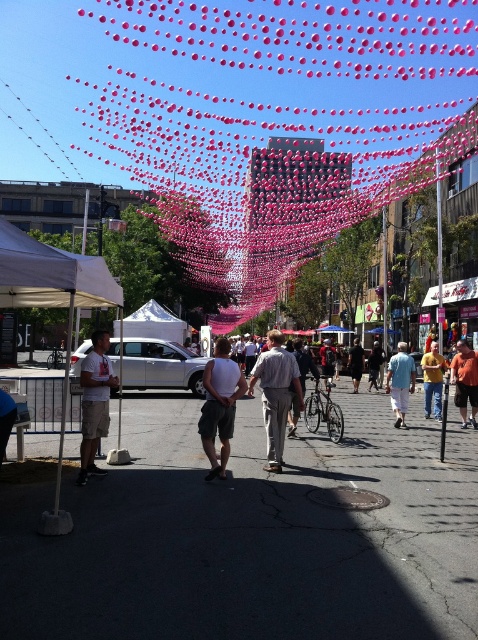
Question: Does white matte shorts at center appear under light gray cotton shirt at center?

Choices:
 (A) no
 (B) yes

Answer: (A)

Question: Can you confirm if white matte shorts at center is wider than light gray cotton shirt at center?

Choices:
 (A) yes
 (B) no

Answer: (B)

Question: Which of the following is the closest to the observer?

Choices:
 (A) white cotton t-shirt at left
 (B) orange cotton shirt at center

Answer: (A)

Question: Which point is farther from the camera taking this photo?

Choices:
 (A) (475, 353)
 (B) (406, 369)
 (C) (272, 440)
 (D) (240, 438)

Answer: (B)

Question: Can you confirm if dark asphalt pavement at center is thinner than white cotton t-shirt at left?

Choices:
 (A) yes
 (B) no

Answer: (B)

Question: Among these objects, which one is nearest to the camera?

Choices:
 (A) dark gray fabric pants at center
 (B) dark asphalt pavement at center
 (C) light gray cotton shirt at center
 (D) orange cotton shirt at center

Answer: (B)